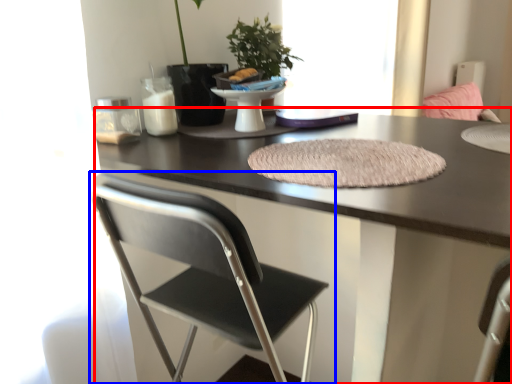
Question: Which object appears farthest to the camera in this image, desk (highlighted by a red box) or chair (highlighted by a blue box)?

Choices:
 (A) desk
 (B) chair

Answer: (B)